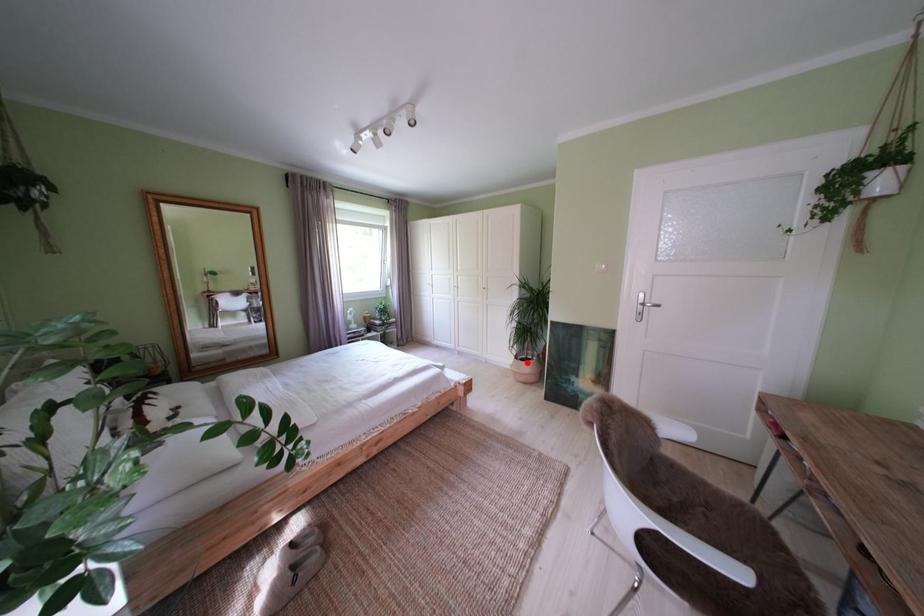
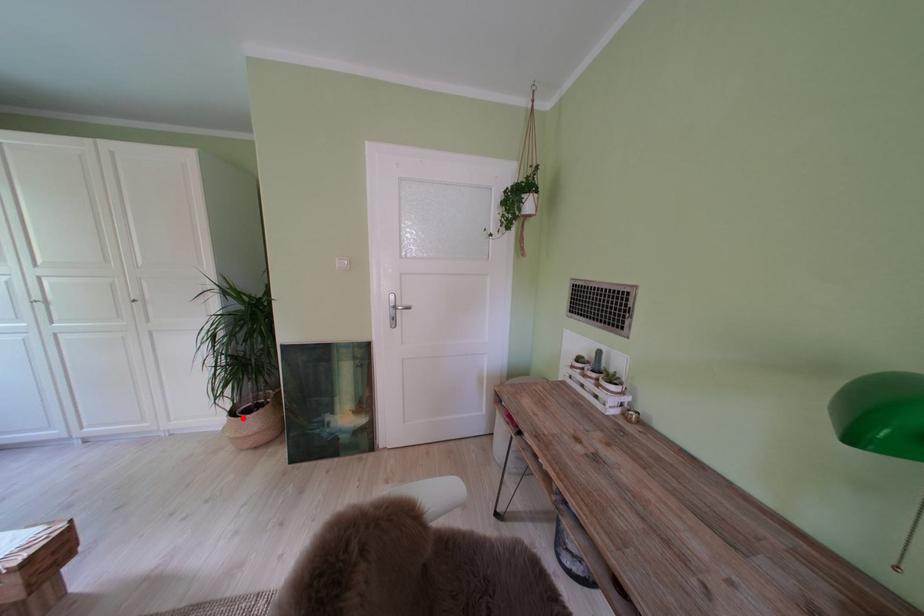
I am providing you with two images of the same scene from different viewpoints. A red point is marked on the first image and another point is marked on the second image. Are the points marked in image1 and image2 representing the same 3D position?

Yes